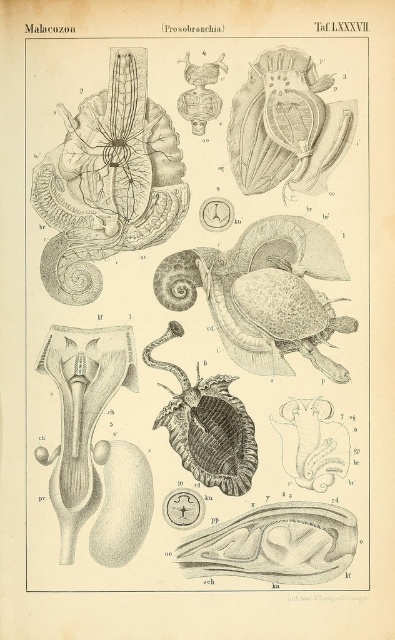
Find the location of `smooth brown snail at center`. smooth brown snail at center is located at coordinates click(263, 292).

Is smooth brown snail at center thinner than smooth beige shell at upper center?

Incorrect, smooth brown snail at center's width is not less than smooth beige shell at upper center's.

Locate an element on the screen. smooth brown snail at center is located at coordinates (263, 292).

Is smooth brown snail at upper left thinner than smooth brown snail at center?

Yes, smooth brown snail at upper left is thinner than smooth brown snail at center.

Is smooth brown snail at upper left to the right of smooth brown snail at center from the viewer's perspective?

No, smooth brown snail at upper left is not to the right of smooth brown snail at center.

Does point (88, 125) lie behind point (169, 280)?

Yes.

Where is `smooth brown snail at upper left`? The height and width of the screenshot is (640, 395). smooth brown snail at upper left is located at coordinates (107, 180).

How distant is smooth gray shell at center from shiny brown shell at center?

2.03 meters

Is smooth gray shell at center bigger than shiny brown shell at center?

Yes.

Where is `smooth gray shell at center`? smooth gray shell at center is located at coordinates (193, 316).